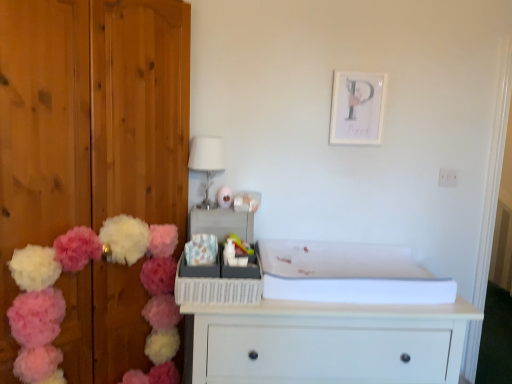
Identify the location of vacant space underneath white glossy lampshade at upper center (from a real-world perspective). The height and width of the screenshot is (384, 512). (202, 206).